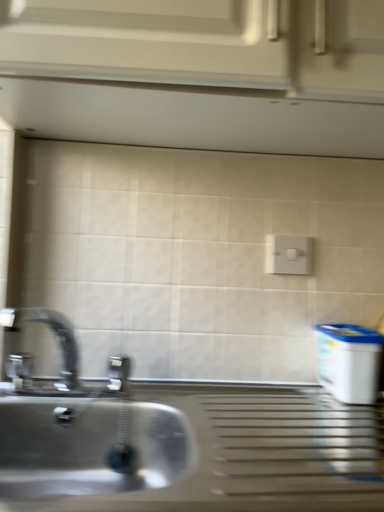
What is the approximate width of stainless steel sink at lower left?

The width of stainless steel sink at lower left is 16.65 inches.

What do you see at coordinates (182, 447) in the screenshot? I see `stainless steel sink at lower left` at bounding box center [182, 447].

The image size is (384, 512). In order to click on stainless steel sink at lower left in this screenshot , I will do `click(182, 447)`.

Image resolution: width=384 pixels, height=512 pixels. I want to click on stainless steel sink at lower left, so click(x=182, y=447).